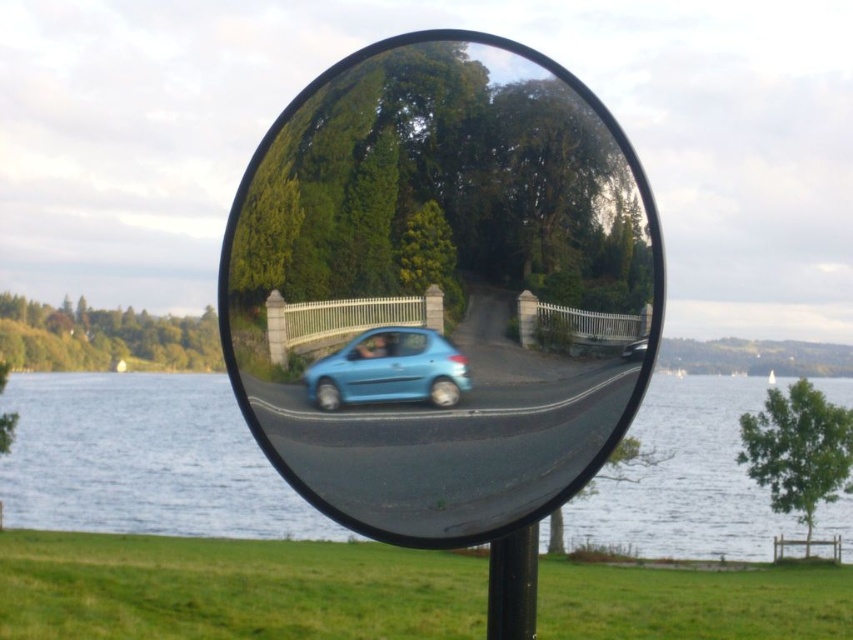
Question: Among these objects, which one is farthest from the camera?

Choices:
 (A) smooth glass mirror at center
 (B) blue water at mirror center

Answer: (B)

Question: Which object is farther from the camera taking this photo?

Choices:
 (A) light blue matte car at center
 (B) smooth glass mirror at center
 (C) blue water at mirror center

Answer: (C)

Question: Is blue water at mirror center positioned before light blue matte car at center?

Choices:
 (A) yes
 (B) no

Answer: (B)

Question: Which point is farther to the camera?

Choices:
 (A) (370, 348)
 (B) (111, 401)

Answer: (B)

Question: Is the position of blue water at mirror center more distant than that of light blue matte car at center?

Choices:
 (A) yes
 (B) no

Answer: (A)

Question: Does blue water at mirror center have a greater width compared to blue glossy car at center?

Choices:
 (A) no
 (B) yes

Answer: (B)